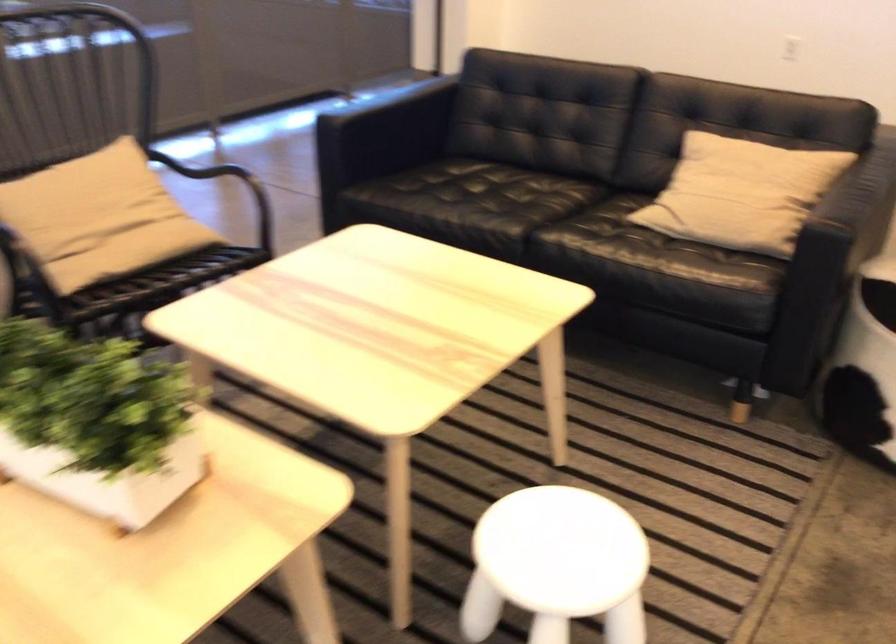
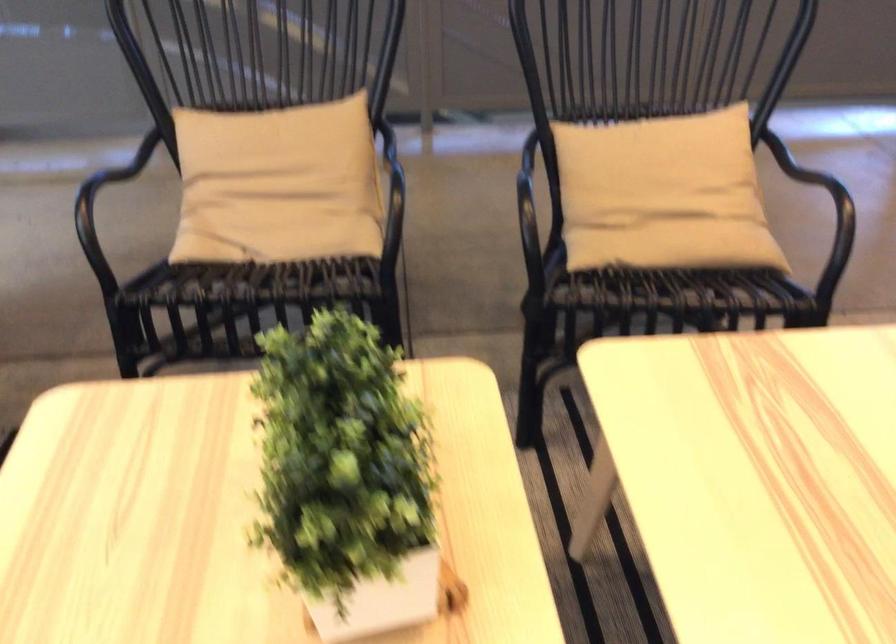
Find the pixel in the second image that matches point (133, 258) in the first image.

(674, 245)